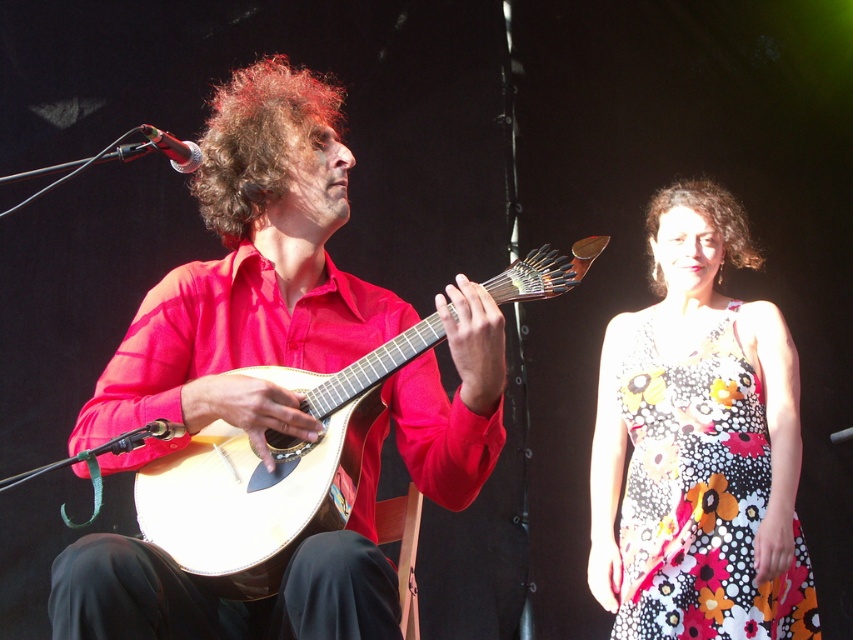
Question: Which object is closer to the camera taking this photo?

Choices:
 (A) curly brown hair at center
 (B) floral print dress at right
 (C) curly brown hair at upper right

Answer: (A)

Question: Where is light wood acoustic guitar at center located in relation to curly brown hair at center in the image?

Choices:
 (A) below
 (B) above

Answer: (A)

Question: Which of these objects is positioned closest to the light wood acoustic guitar at center?

Choices:
 (A) floral print dress at right
 (B) curly brown hair at center
 (C) matte red shirt at center
 (D) curly brown hair at upper right

Answer: (C)

Question: Is the position of matte red shirt at center less distant than that of curly brown hair at upper right?

Choices:
 (A) no
 (B) yes

Answer: (B)

Question: Estimate the real-world distances between objects in this image. Which object is closer to the curly brown hair at upper right?

Choices:
 (A) light wood acoustic guitar at center
 (B) matte red shirt at center
 (C) curly brown hair at center

Answer: (A)

Question: Can you confirm if floral print dress at right is wider than curly brown hair at center?

Choices:
 (A) yes
 (B) no

Answer: (A)